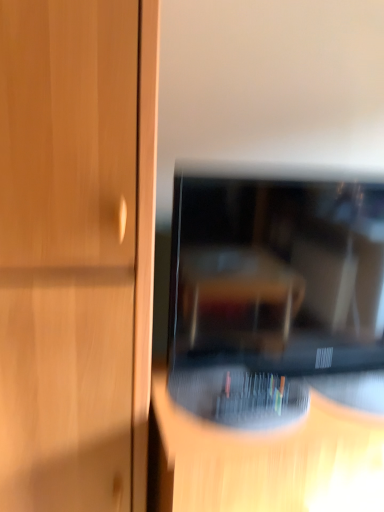
Question: Considering the positions of black glossy television at center and transparent plastic cd case at center in the image, is black glossy television at center taller or shorter than transparent plastic cd case at center?

Choices:
 (A) short
 (B) tall

Answer: (A)

Question: Is point (256, 293) closer or farther from the camera than point (327, 488)?

Choices:
 (A) farther
 (B) closer

Answer: (A)

Question: Is black glossy television at center wider or thinner than transparent plastic cd case at center?

Choices:
 (A) thin
 (B) wide

Answer: (A)

Question: Is transparent plastic cd case at center situated inside black glossy television at center or outside?

Choices:
 (A) outside
 (B) inside

Answer: (A)

Question: In the image, is transparent plastic cd case at center on the left side or the right side of black glossy television at center?

Choices:
 (A) right
 (B) left

Answer: (A)

Question: Does point (355, 505) appear closer or farther from the camera than point (324, 342)?

Choices:
 (A) farther
 (B) closer

Answer: (B)

Question: Considering their positions, is transparent plastic cd case at center located in front of or behind black glossy television at center?

Choices:
 (A) behind
 (B) front

Answer: (B)